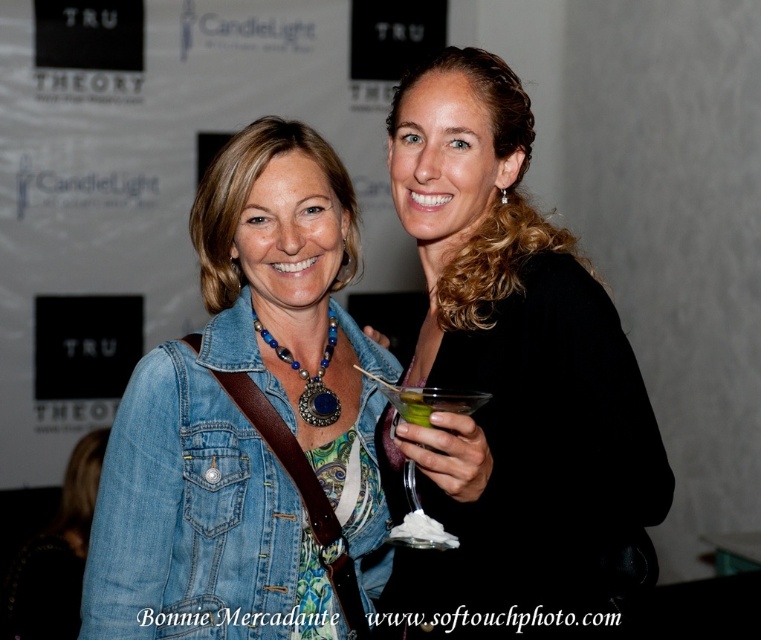
Question: Among these points, which one is farthest from the camera?

Choices:
 (A) (454, 397)
 (B) (416, 508)
 (C) (482, 212)

Answer: (C)

Question: Which is farther from the denim jacket at lower right?

Choices:
 (A) green translucent glass at center
 (B) clear glass martini glass at center

Answer: (A)

Question: Can you confirm if black matte dress at right is bigger than clear glass martini glass at center?

Choices:
 (A) no
 (B) yes

Answer: (B)

Question: Is black matte dress at right wider than green translucent glass at center?

Choices:
 (A) yes
 (B) no

Answer: (A)

Question: Which of the following is the farthest from the observer?

Choices:
 (A) (397, 134)
 (B) (419, 504)
 (C) (217, 560)
 (D) (422, 388)

Answer: (A)

Question: Can you confirm if clear glass martini glass at center is positioned to the right of green translucent glass at center?

Choices:
 (A) no
 (B) yes

Answer: (A)